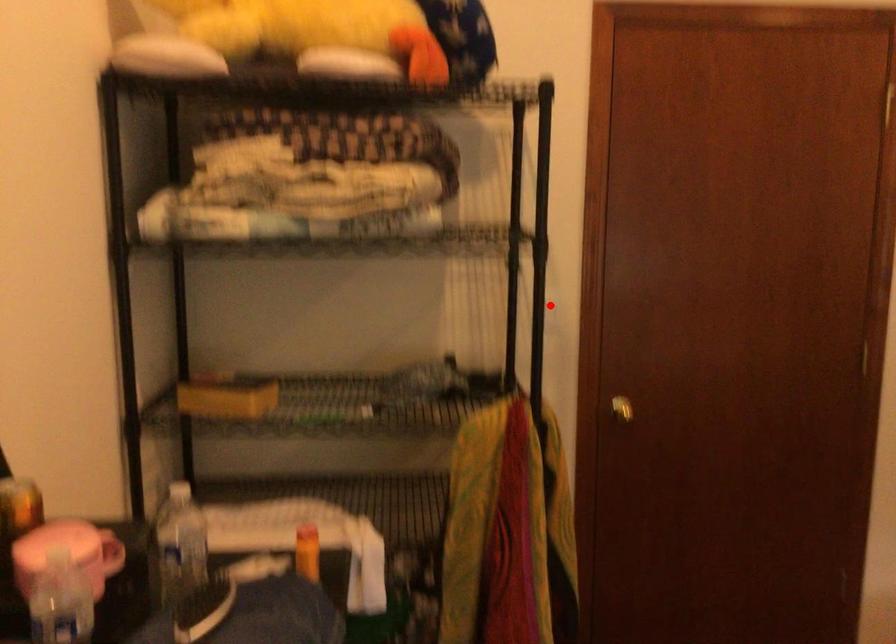
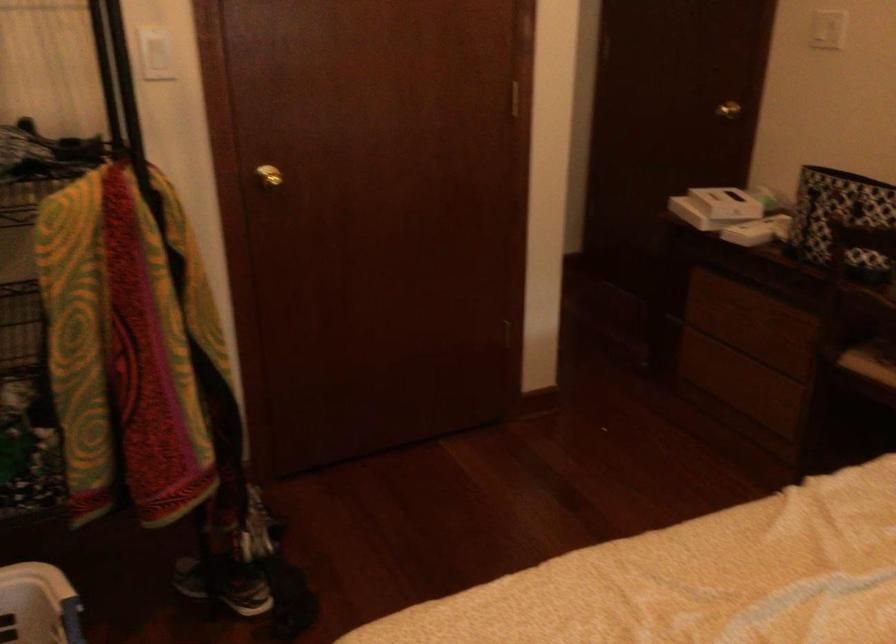
Question: I am providing you with two images of the same scene from different viewpoints. A red point is shown in image1. For the corresponding object point in image2, is it positioned nearer or farther from the camera?

Choices:
 (A) Nearer
 (B) Farther

Answer: (A)